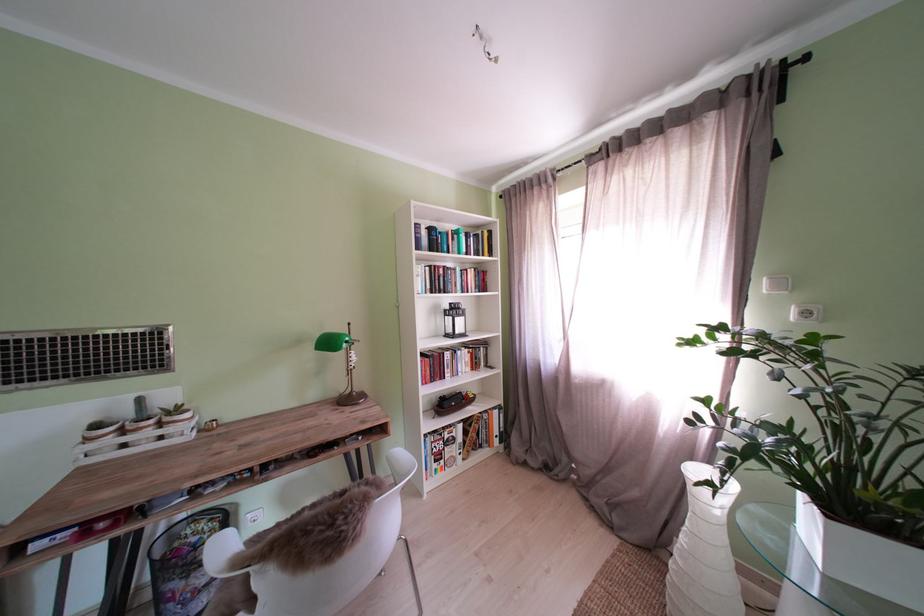
Find the location of `white chair armrest`. white chair armrest is located at coordinates (396, 464).